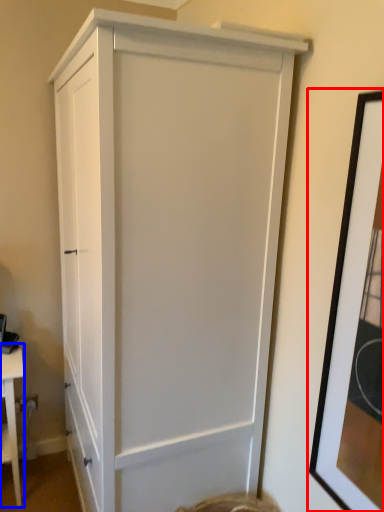
Question: Which point is closer to the camera, picture frame (highlighted by a red box) or table (highlighted by a blue box)?

Choices:
 (A) picture frame
 (B) table

Answer: (A)